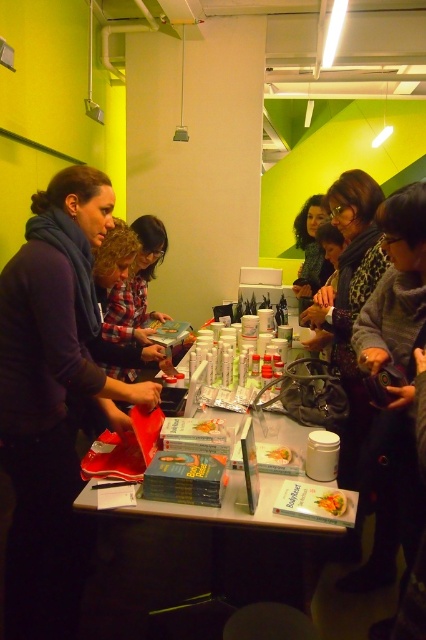
From the picture: Can you confirm if white glossy table at center is taller than green leafy vegetable at center?

Indeed, white glossy table at center has a greater height compared to green leafy vegetable at center.

Which is in front, point (219, 592) or point (339, 493)?

Point (339, 493)

Identify the location of white glossy table at center. This screenshot has height=640, width=426. pyautogui.click(x=198, y=557).

Is white glossy table at center smaller than smooth plastic container at center?

No.

Can you confirm if white glossy table at center is positioned to the left of smooth plastic container at center?

Correct, you'll find white glossy table at center to the left of smooth plastic container at center.

Locate an element on the screen. white glossy table at center is located at coordinates coord(198,557).

Can you confirm if matte black scarf at left is taller than smooth plastic container at center?

Yes.

Is point (71, 596) less distant than point (287, 451)?

No.

The image size is (426, 640). Identify the location of matte black scarf at left. (54, 396).